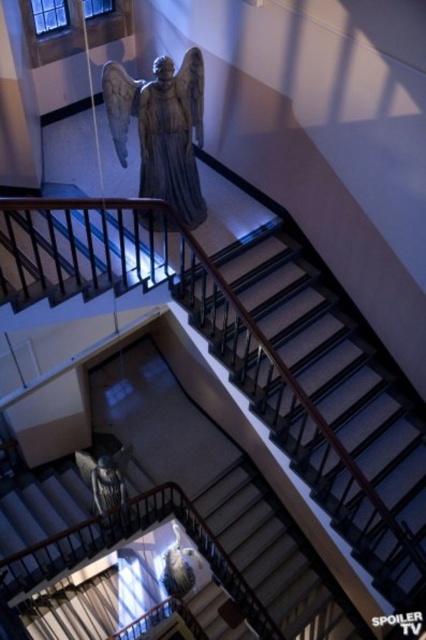
In the scene shown: You are an interior designer planning to place a new decorative item in the space. You have two options to choose from. The first option is a large sculpture that is the same size as the smooth gray stairs at center. The second option is a small sculpture that is the same size as the matte gray statue at center. Which option would you choose if you want the sculpture to be more noticeable in the grand staircase?

The smooth gray stairs at center is bigger than the matte gray statue at center, so choosing the large sculpture that matches the size of the smooth gray stairs at center would make it more noticeable in the grand staircase.

You are a delivery person carrying a large box that is 1.2 meters wide. You need to navigate through the space between the smooth gray stairs at center and the black metal balustrade at upper center. Can you fit through this space?

The smooth gray stairs at center might be wider than black metal balustrade at upper center, so the space between them could be sufficient for the 1.2 meter wide box. However, since the exact width isn not specified, it is uncertain. Proceed with caution and measure the space first.

You are an architect designing a new building and want to ensure that the smooth gray stairs at center and the white marble pillar at upper left are proportionate. Based on the image, which object is significantly taller?

The smooth gray stairs at center are much taller than the white marble pillar at upper left according to the description.